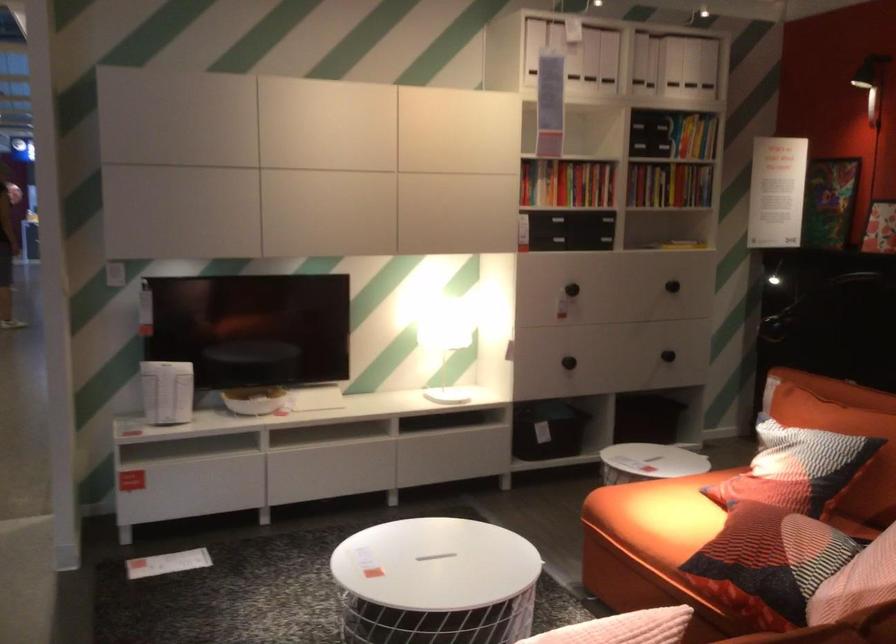
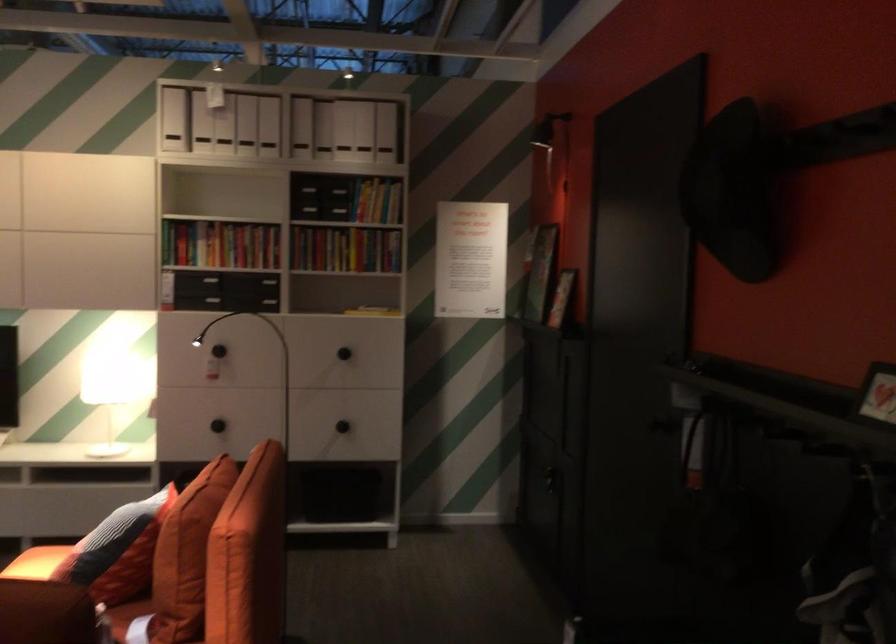
The point at (595, 166) is marked in the first image. Where is the corresponding point in the second image?

(220, 243)